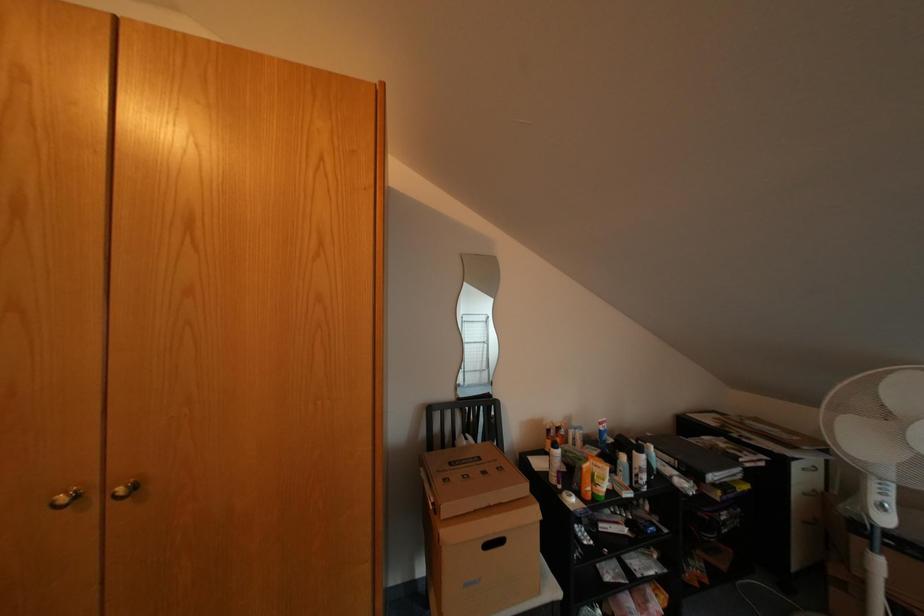
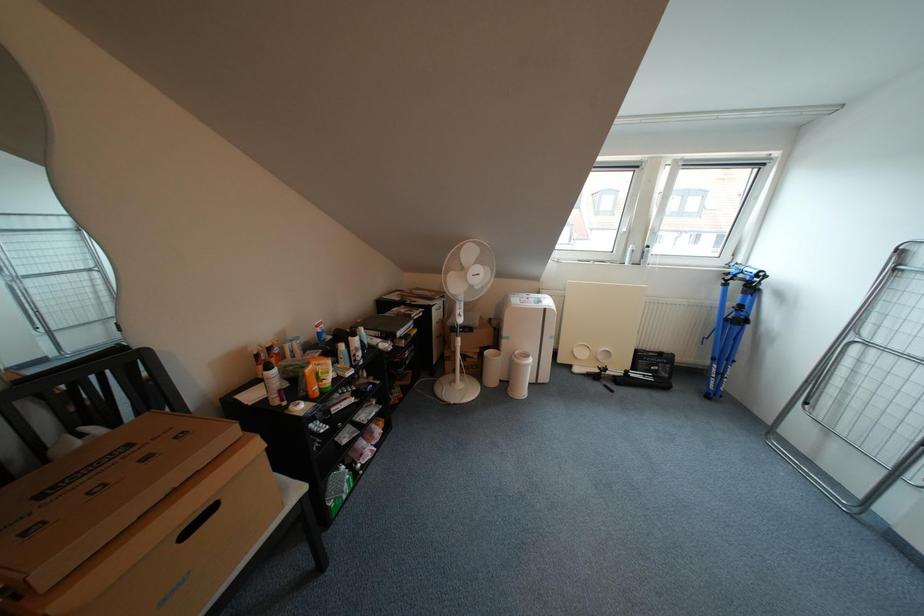
The first image is from the beginning of the video and the second image is from the end. How did the camera likely rotate when shooting the video?

The rotation direction of the camera is right-down.